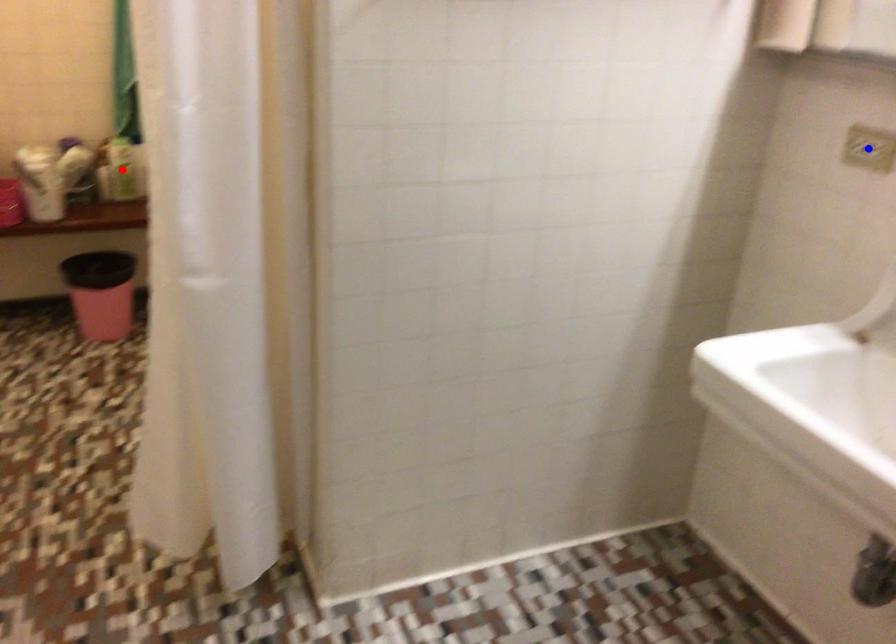
Question: In the image, two points are highlighted. Which point is nearer to the camera? Reply with the corresponding letter.

Choices:
 (A) blue point
 (B) red point

Answer: (A)